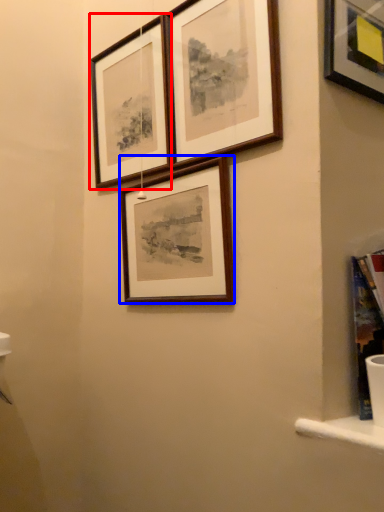
Question: Which object is further to the camera taking this photo, picture frame (highlighted by a red box) or picture frame (highlighted by a blue box)?

Choices:
 (A) picture frame
 (B) picture frame

Answer: (A)